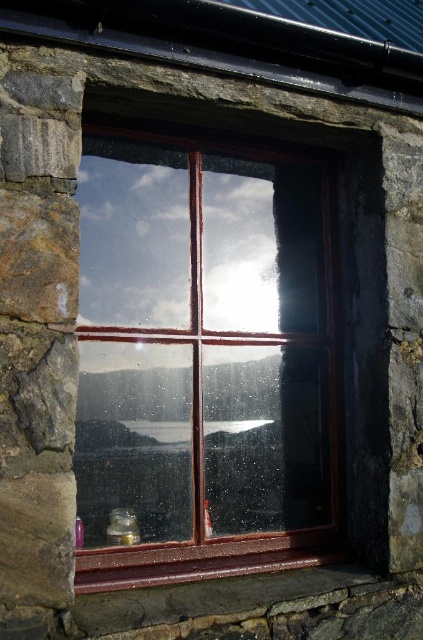
Can you confirm if wooden window at center is wider than brown wood at bottom?

Indeed, wooden window at center has a greater width compared to brown wood at bottom.

Which of these two, wooden window at center or brown wood at bottom, stands shorter?

brown wood at bottom is shorter.

The image size is (423, 640). I want to click on wooden window at center, so click(x=203, y=358).